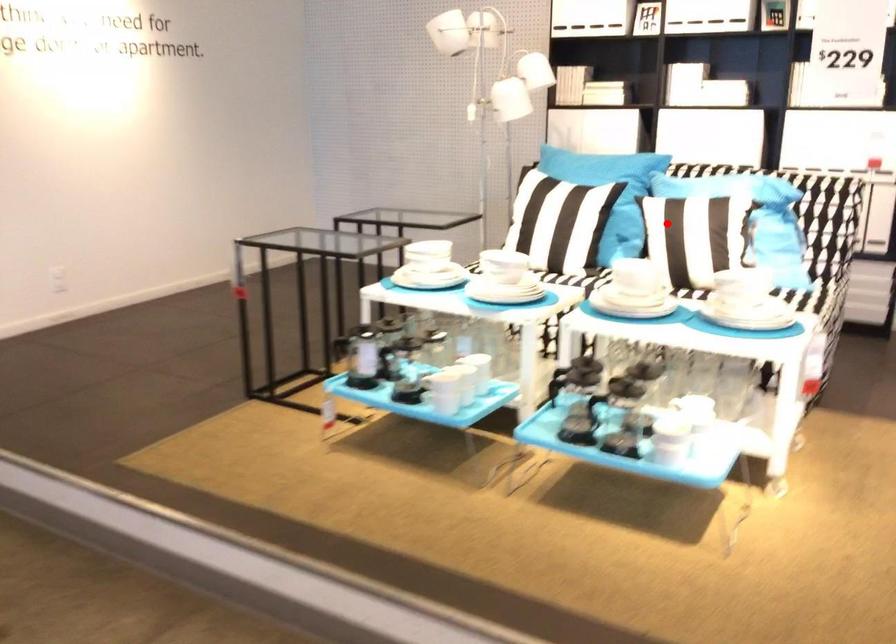
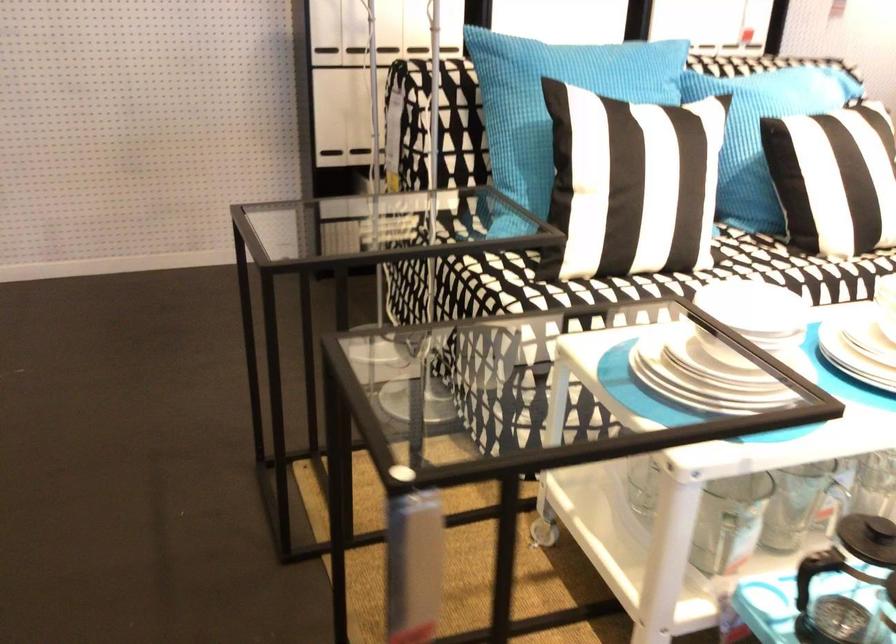
Question: I am providing you with two images of the same scene from different viewpoints. A red point is marked on the first image. At the location where the point appears in image 1, is it still visible in image 2?

Choices:
 (A) Yes
 (B) No

Answer: (A)